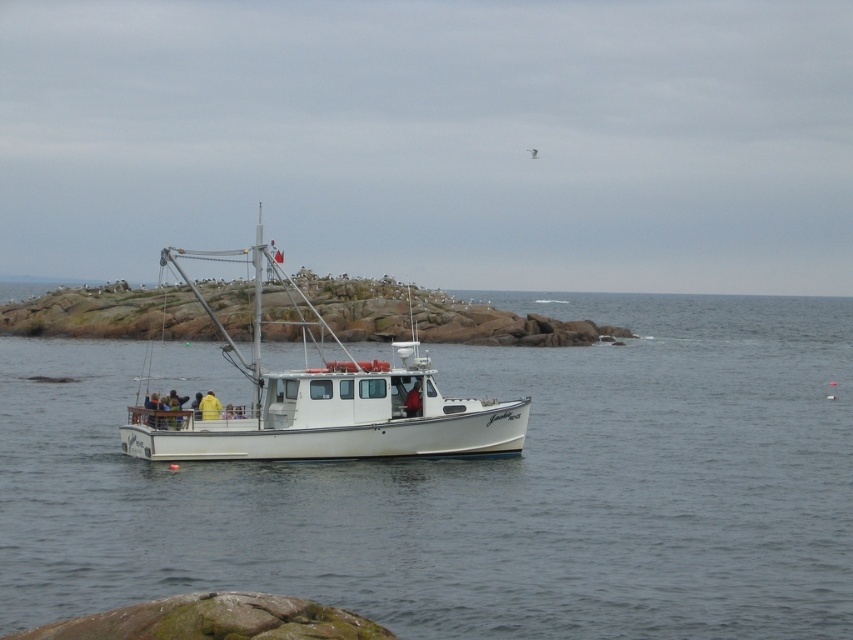
You are standing on a cliff overlooking the water. You see the clear water at center and the white matte boat at center. Which object is closer to you?

The clear water at center is closer to the viewer than the white matte boat at center.

You are standing on the deck of the small white fishing boat and want to locate the clear water at center. According to the coordinate system where the bottom left corner is the origin, can you confirm if the point at [479,486] is where the clear water at center is located?

Yes, the point at [479,486] corresponds to the clear water at center as described in the scene.

You are a sailor on the white matte boat at center. You want to check the water quality below your boat. Where should you look to find the clear water at center?

The clear water at center is located below the white matte boat at center, so you should look directly beneath the white matte boat at center to find the clear water at center.